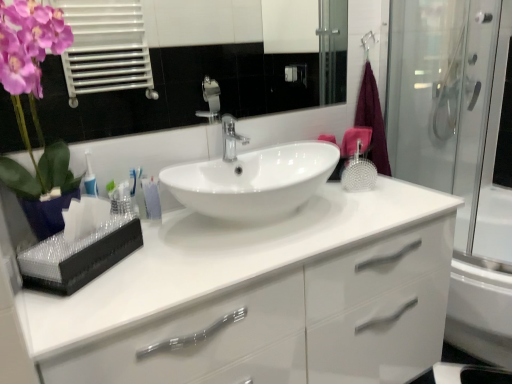
The image size is (512, 384). Identify the location of vacant area in front of translucent plastic toothbrushes at left. (159, 246).